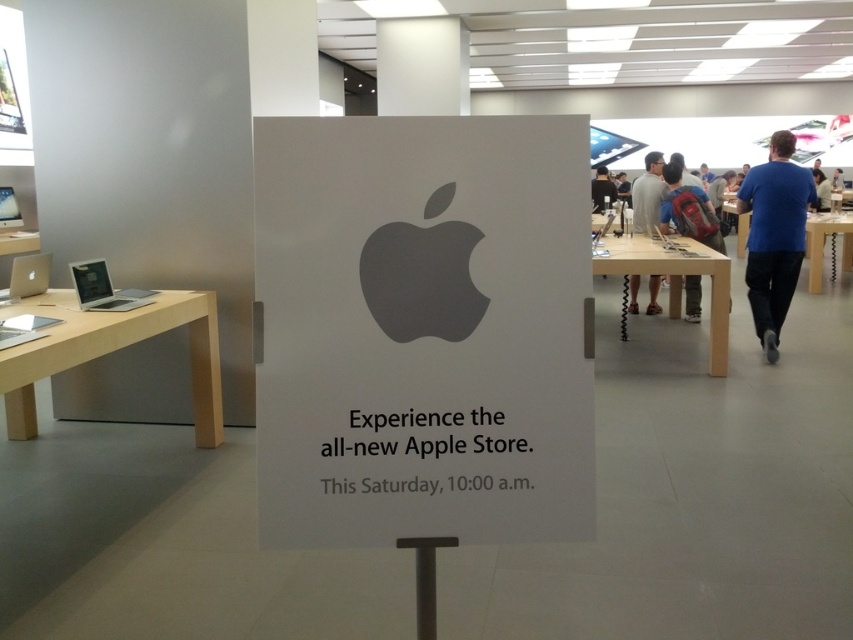
You are a customer entering the Apple Store and see the white paper sign at center and the gray matte apple logo at center. Which object is located to the right of the other?

The white paper sign at center is positioned on the right side of gray matte apple logo at center, so the white paper sign at center is to the right of the gray matte apple logo at center.

You are a customer standing in front of the store entrance. You see the white paper sign at center and the gray matte apple logo at center. Which object is physically nearer to you?

The white paper sign at center is closer to the viewer than the gray matte apple logo at center, so the white paper sign at center is physically nearer to you.